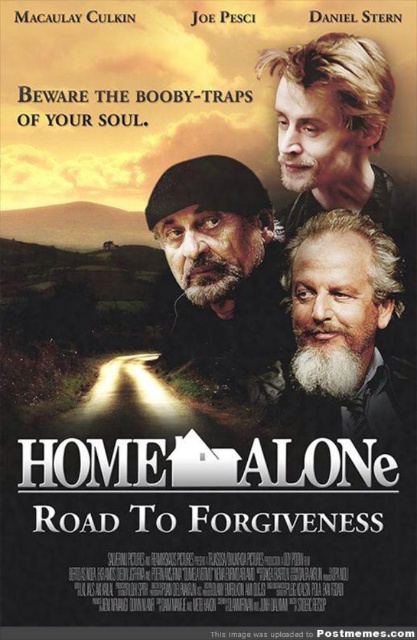
Question: Among these objects, which one is farthest from the camera?

Choices:
 (A) blonde hair at upper right
 (B) gray beard at lower right

Answer: (B)

Question: Is gray beard at lower right bigger than blonde hair at upper right?

Choices:
 (A) no
 (B) yes

Answer: (B)

Question: Which of the following is the farthest from the observer?

Choices:
 (A) (193, 326)
 (B) (324, 154)

Answer: (A)

Question: Can you confirm if gray beard at lower right is positioned below blonde hair at upper right?

Choices:
 (A) yes
 (B) no

Answer: (A)

Question: Which point is closer to the camera?

Choices:
 (A) gray beard at lower right
 (B) gray beard at center
 (C) blonde hair at upper right

Answer: (B)

Question: Can you confirm if gray beard at lower right is bigger than blonde hair at upper right?

Choices:
 (A) no
 (B) yes

Answer: (B)